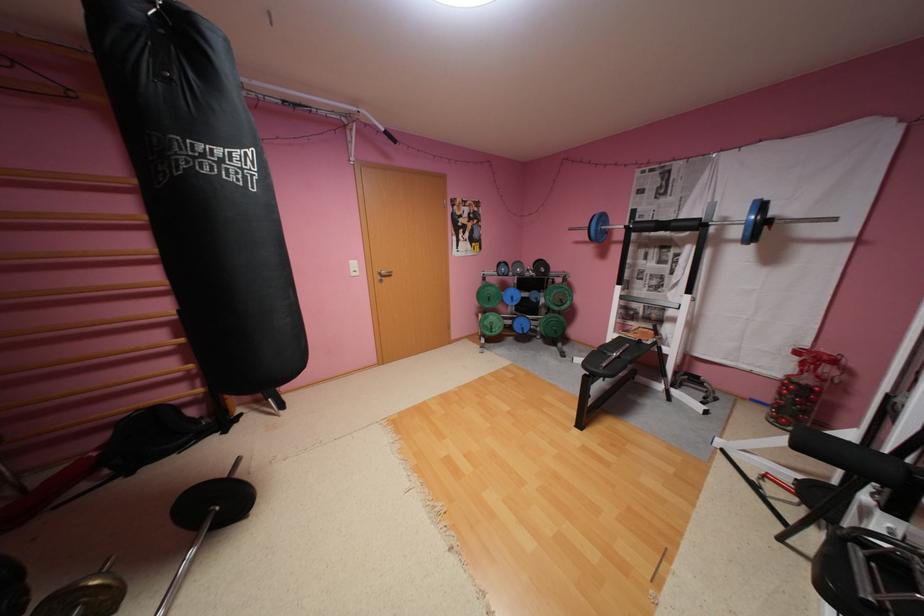
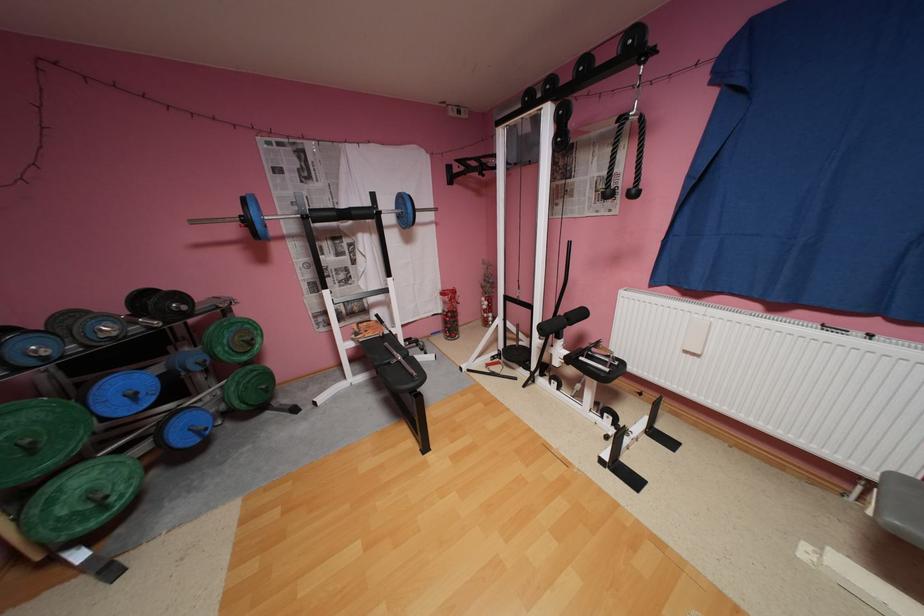
Locate, in the second image, the point that corresponds to the point at 683,224 in the first image.

(362, 213)